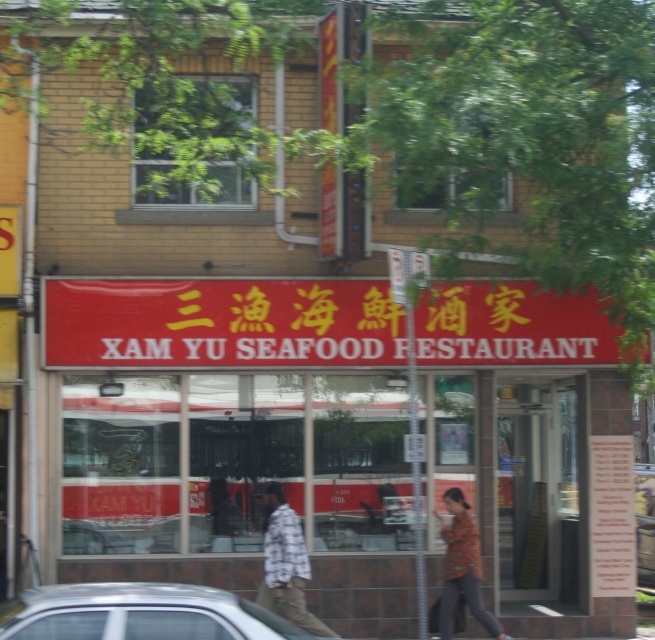
Question: Which point is farther to the camera?

Choices:
 (A) silver metallic car at lower left
 (B) floral-patterned jacket at lower right
 (C) red matte sign at center

Answer: (C)

Question: Is silver metallic car at lower left closer to camera compared to floral-patterned jacket at lower right?

Choices:
 (A) yes
 (B) no

Answer: (A)

Question: Among these objects, which one is nearest to the camera?

Choices:
 (A) flannel shirt at center
 (B) floral-patterned jacket at lower right
 (C) red matte sign at center

Answer: (A)

Question: Is silver metallic car at lower left positioned in front of floral-patterned jacket at lower right?

Choices:
 (A) no
 (B) yes

Answer: (B)

Question: Which point is closer to the camera taking this photo?

Choices:
 (A) (464, 506)
 (B) (105, 346)
 (C) (272, 609)

Answer: (C)

Question: Can you confirm if red matte sign at center is bigger than silver metallic car at lower left?

Choices:
 (A) no
 (B) yes

Answer: (B)